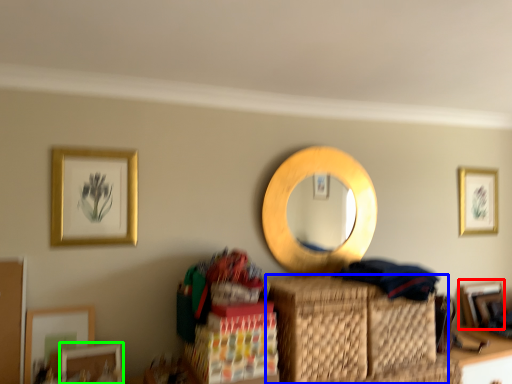
Question: Considering the real-world distances, which object is farthest from picture frame (highlighted by a red box)? basket (highlighted by a blue box) or picture frame (highlighted by a green box)?

Choices:
 (A) basket
 (B) picture frame

Answer: (B)